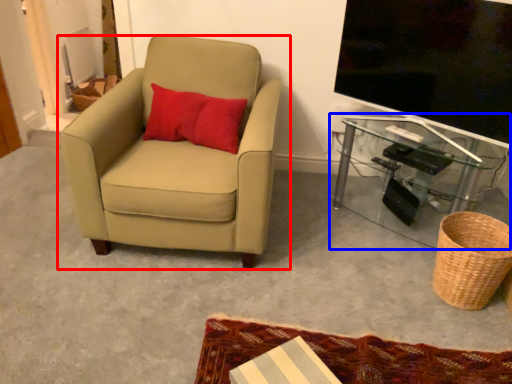
Question: Among these objects, which one is nearest to the camera, chair (highlighted by a red box) or table (highlighted by a blue box)?

Choices:
 (A) chair
 (B) table

Answer: (A)